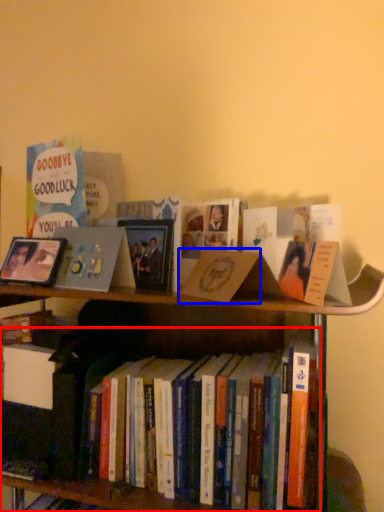
Question: Which object appears closest to the camera in this image, book (highlighted by a red box) or paperback book (highlighted by a blue box)?

Choices:
 (A) book
 (B) paperback book

Answer: (B)